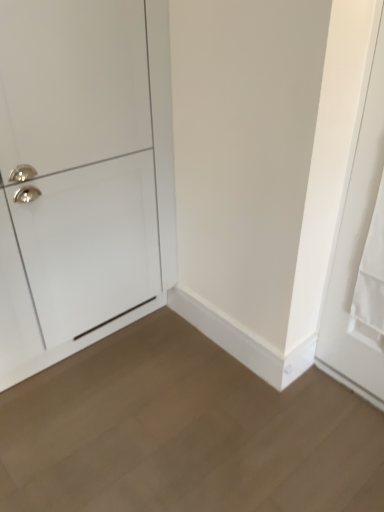
At what (x,y) coordinates should I click in order to perform the action: click on vacant area that is in front of white matte door at right, the first door when ordered from right to left. Please return your answer as a coordinate pair (x, y). Looking at the image, I should click on (348, 426).